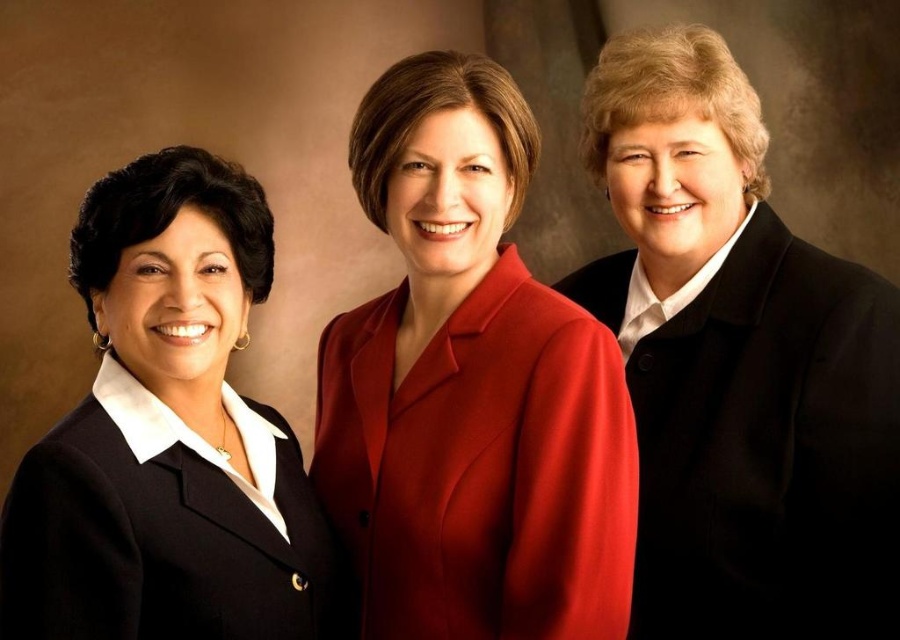
You are a photographer adjusting the focus on your camera. You notice two points in the image at coordinates point [447,632] and point [205,296]. Which point should you focus on first if you want to ensure the closest object is in focus?

You should focus on point [447,632] first because it is closer to the camera than point [205,296] according to the description.

You are a photographer adjusting your camera settings to focus on two specific points in the image. The first point is at coordinates point (185, 358) and the second point is at point (896, 484). Given that you can only focus on one point at a time, which point should you choose to ensure the subject closest to the camera is in focus?

You should focus on point (185, 358) because it is closer to the camera than point (896, 484).